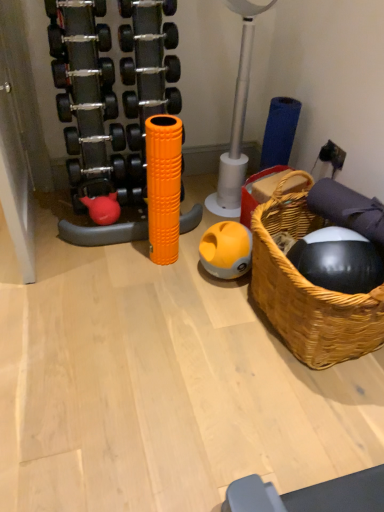
This screenshot has width=384, height=512. Identify the location of woven wood basket at right. (308, 289).

Describe the element at coordinates (226, 250) in the screenshot. The width and height of the screenshot is (384, 512). I see `yellow matte ball at center` at that location.

This screenshot has width=384, height=512. I want to click on woven wood basket at right, so click(x=308, y=289).

From a real-world perspective, who is located higher, yellow matte ball at center or woven wood basket at right?

woven wood basket at right.

Is yellow matte ball at center facing away from woven wood basket at right?

No.

Is yellow matte ball at center spatially inside woven wood basket at right, or outside of it?

yellow matte ball at center is spatially situated outside woven wood basket at right.

Measure the distance from yellow matte ball at center to woven wood basket at right.

29.03 centimeters.

Is yellow matte ball at center at the back of woven wood basket at right?

No.

Does point (258, 298) appear closer or farther from the camera than point (214, 262)?

Point (258, 298) is positioned closer to the camera compared to point (214, 262).

Considering the positions of objects woven wood basket at right and yellow matte ball at center in the image provided, who is more to the left, woven wood basket at right or yellow matte ball at center?

Positioned to the left is yellow matte ball at center.

Which object is more forward, orange foam roller at center or yellow matte ball at center?

orange foam roller at center is in front.

Is orange foam roller at center turned away from yellow matte ball at center?

No, orange foam roller at center's orientation is not away from yellow matte ball at center.

Is point (169, 141) more distant than point (206, 245)?

No, it is not.

From a real-world perspective, between orange foam roller at center and yellow matte ball at center, who is vertically lower?

yellow matte ball at center is physically lower.

In the scene shown: From a real-world perspective, is woven wood basket at right located higher than orange foam roller at center?

Actually, woven wood basket at right is physically below orange foam roller at center in the real world.

Is point (273, 324) less distant than point (159, 211)?

That is True.

From the image's perspective, which is below, woven wood basket at right or orange foam roller at center?

woven wood basket at right.

Considering the sizes of objects orange foam roller at center and woven wood basket at right in the image provided, who is smaller, orange foam roller at center or woven wood basket at right?

orange foam roller at center is smaller.

Measure the distance from orange foam roller at center to woven wood basket at right.

orange foam roller at center and woven wood basket at right are 22.90 inches apart.

The height and width of the screenshot is (512, 384). Identify the location of toy located behind the woven wood basket at right. (163, 186).

From the image's perspective, is orange foam roller at center located above or below woven wood basket at right?

orange foam roller at center is situated higher than woven wood basket at right in the image.

Could you tell me if yellow matte ball at center is turned towards orange foam roller at center?

No, yellow matte ball at center is not oriented towards orange foam roller at center.

Is yellow matte ball at center located outside orange foam roller at center?

Yes, yellow matte ball at center is outside of orange foam roller at center.

Is point (234, 251) positioned before point (149, 175)?

No, it is behind (149, 175).

From a real-world perspective, is yellow matte ball at center located higher than orange foam roller at center?

No, from a real-world perspective, yellow matte ball at center is not on top of orange foam roller at center.

This screenshot has height=512, width=384. I want to click on basket that is below the yellow matte ball at center (from the image's perspective), so click(308, 289).

You are a GUI agent. You are given a task and a screenshot of the screen. Output one action in this format:
    pyautogui.click(x=<x>, y=<y>)
    Task: Click on the ball on the left of woven wood basket at right
    The image size is (384, 512).
    Given the screenshot: What is the action you would take?
    pyautogui.click(x=226, y=250)

From the image, which object appears to be nearer to yellow matte ball at center, woven wood basket at right or orange foam roller at center?

The object closer to yellow matte ball at center is orange foam roller at center.

Estimate the real-world distances between objects in this image. Which object is further from orange foam roller at center, yellow matte ball at center or woven wood basket at right?

Among the two, woven wood basket at right is located further to orange foam roller at center.

Estimate the real-world distances between objects in this image. Which object is further from yellow matte ball at center, orange foam roller at center or woven wood basket at right?

The object further to yellow matte ball at center is woven wood basket at right.

Which object lies further to the anchor point orange foam roller at center, woven wood basket at right or yellow matte ball at center?

woven wood basket at right lies further to orange foam roller at center than the other object.

Looking at the image, which one is located closer to woven wood basket at right, orange foam roller at center or yellow matte ball at center?

Based on the image, yellow matte ball at center appears to be nearer to woven wood basket at right.

Which object lies nearer to the anchor point woven wood basket at right, yellow matte ball at center or orange foam roller at center?

The object closer to woven wood basket at right is yellow matte ball at center.

At what (x,y) coordinates should I click in order to perform the action: click on ball between orange foam roller at center and woven wood basket at right from left to right. Please return your answer as a coordinate pair (x, y). The height and width of the screenshot is (512, 384). Looking at the image, I should click on (226, 250).